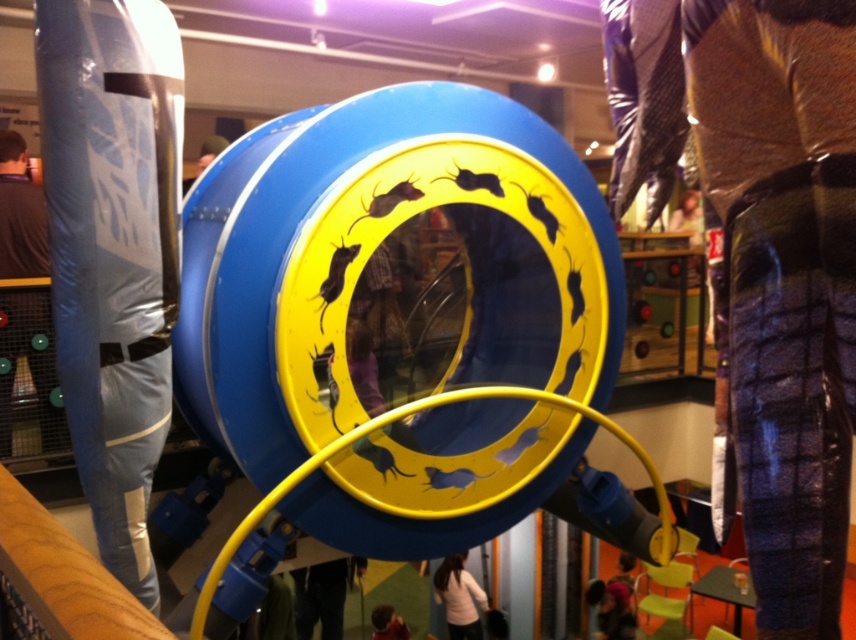
You are standing in front of the exhibit and want to place your brown fuzzy sweater at left on the yellow circular frame. Based on its current position, can you determine if the sweater will fit on the frame?

The brown fuzzy sweater at left is positioned at point (21,214), which is within the boundaries of the yellow circular frame, so it should fit.

You are a visitor standing in front of the exhibit and notice two items in the image. The first is plaid fabric pants at right and the second is smooth brown hair at center. Which of these two items is taller?

The plaid fabric pants at right is taller than smooth brown hair at center.

You are standing in front of the exhibit and need to place a small sticker on the plaid fabric pants at right. According to the coordinates provided, where exactly should you place it?

The plaid fabric pants at right should have the sticker placed at point [762,256] as specified in the coordinates.